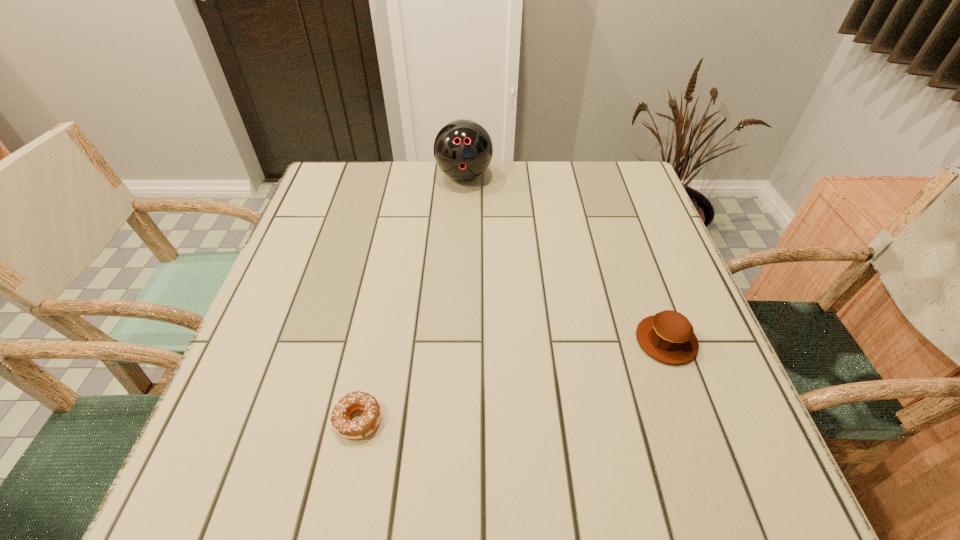
Identify the location of bowling ball. (463, 150).

Where is `the tallest object`? the tallest object is located at coordinates (463, 150).

The height and width of the screenshot is (540, 960). In order to click on the rightmost object in this screenshot , I will do `click(668, 336)`.

Where is `the second tallest object`? The image size is (960, 540). the second tallest object is located at coordinates (668, 336).

The width and height of the screenshot is (960, 540). Identify the location of doughnut. (357, 400).

You are a GUI agent. You are given a task and a screenshot of the screen. Output one action in this format:
    pyautogui.click(x=<x>, y=<y>)
    Task: Click on the shortest object
    The width and height of the screenshot is (960, 540).
    Given the screenshot: What is the action you would take?
    pyautogui.click(x=357, y=400)

Find the location of a particular element. The image size is (960, 540). free location located on the surface of the bowling ball near the finger holes is located at coordinates (462, 217).

The height and width of the screenshot is (540, 960). I want to click on free space located on the left of the rightmost object, so click(480, 341).

Where is `blank space located 0.070m on the back of the shortest object`? blank space located 0.070m on the back of the shortest object is located at coordinates (370, 364).

You are a GUI agent. You are given a task and a screenshot of the screen. Output one action in this format:
    pyautogui.click(x=<x>, y=<y>)
    Task: Click on the object present at the far edge
    The image size is (960, 540).
    Given the screenshot: What is the action you would take?
    pyautogui.click(x=463, y=150)